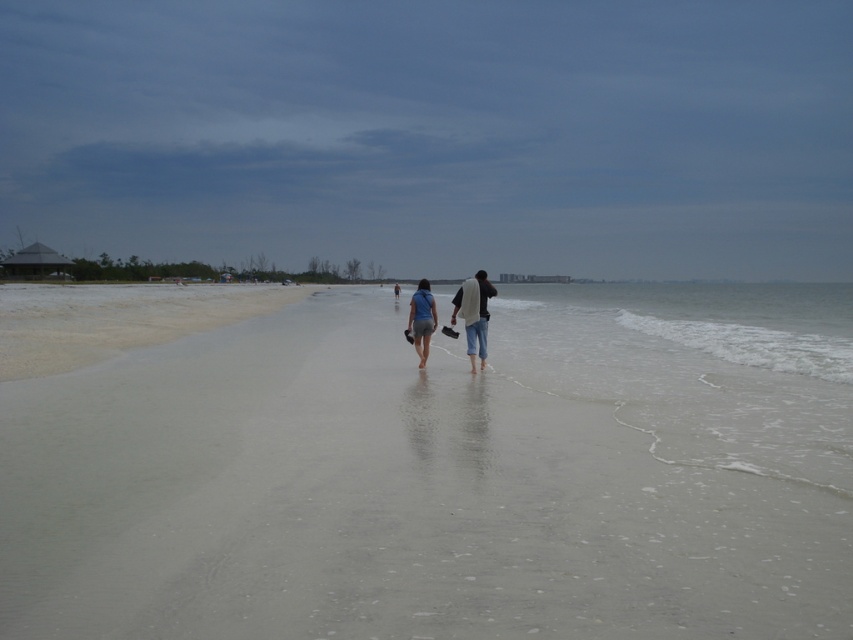
Who is positioned more to the right, sandy beach at center or white sand at lower left?

Positioned to the right is sandy beach at center.

In the scene shown: Which is more to the left, sandy beach at center or white sand at lower left?

white sand at lower left

Image resolution: width=853 pixels, height=640 pixels. Identify the location of sandy beach at center. (428, 467).

Identify the location of sandy beach at center. (428, 467).

Between denim jacket at center and matte blue shorts at center, which one has less height?

Standing shorter between the two is matte blue shorts at center.

Can you confirm if denim jacket at center is positioned below matte blue shorts at center?

No.

This screenshot has width=853, height=640. Describe the element at coordinates (474, 314) in the screenshot. I see `denim jacket at center` at that location.

Locate an element on the screen. The width and height of the screenshot is (853, 640). denim jacket at center is located at coordinates (474, 314).

Is white sand at lower left to the right of matte blue shorts at center from the viewer's perspective?

No, white sand at lower left is not to the right of matte blue shorts at center.

Can you confirm if white sand at lower left is positioned below matte blue shorts at center?

No, white sand at lower left is not below matte blue shorts at center.

Is point (111, 314) closer to viewer compared to point (418, 288)?

No, it is behind (418, 288).

The width and height of the screenshot is (853, 640). I want to click on white sand at lower left, so click(x=115, y=320).